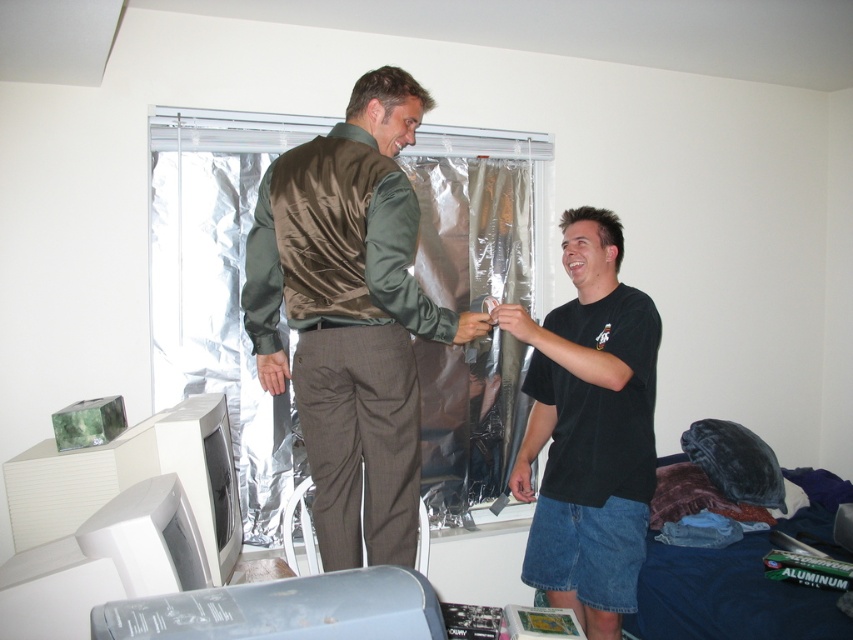
Can you confirm if satin brown vest at center is taller than black matte t-shirt at center?

Incorrect, satin brown vest at center's height is not larger of black matte t-shirt at center's.

Which of these two, satin brown vest at center or black matte t-shirt at center, stands shorter?

satin brown vest at center

Which is in front, point (263, 385) or point (592, 611)?

Point (263, 385) is in front.

The width and height of the screenshot is (853, 640). I want to click on satin brown vest at center, so click(x=350, y=316).